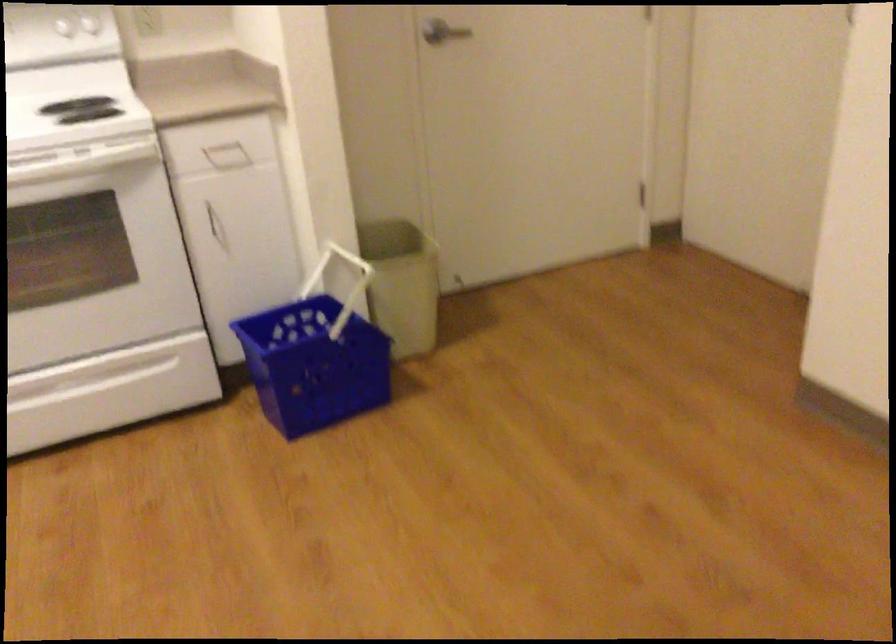
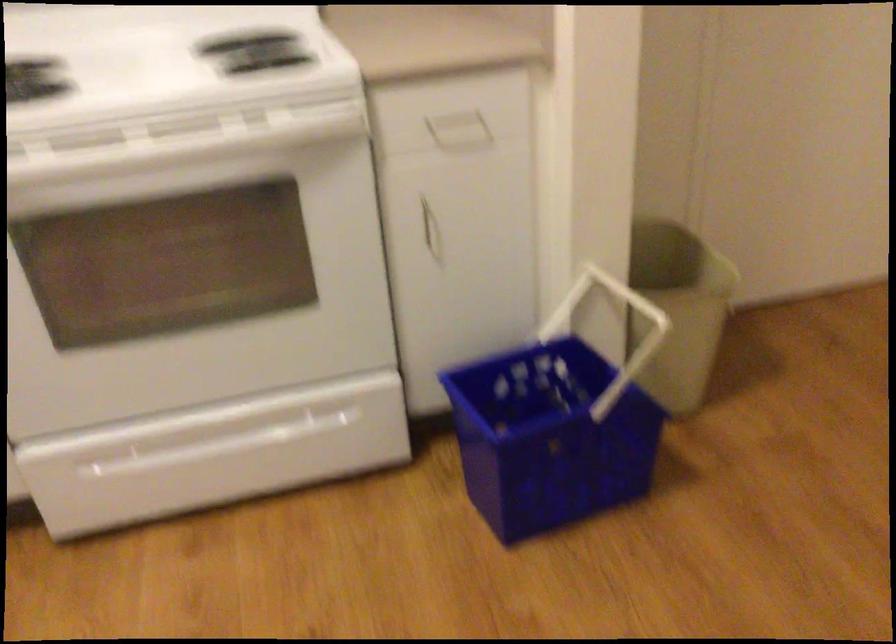
Locate, in the second image, the point that corresponds to (85,389) in the first image.

(233, 440)